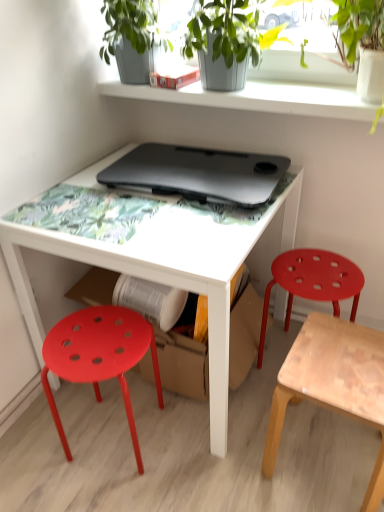
At what (x,y) coordinates should I click in order to perform the action: click on empty space that is ontop of light brown wooden stool at lower right, which appears as the second stool when viewed from the right. Please return your answer as a coordinate pair (x, y). The width and height of the screenshot is (384, 512). Looking at the image, I should click on (337, 366).